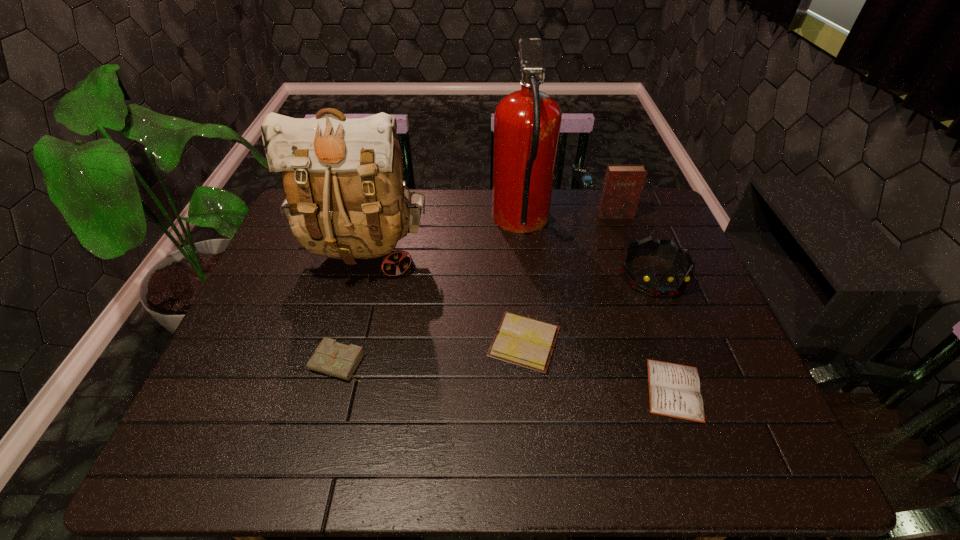
The width and height of the screenshot is (960, 540). In order to click on vacant region located with the handle and nozzle on the fire extinguisher in this screenshot , I will do `click(465, 223)`.

Locate an element on the screen. Image resolution: width=960 pixels, height=540 pixels. blank area located 0.240m with the handle and nozzle on the fire extinguisher is located at coordinates (418, 223).

Image resolution: width=960 pixels, height=540 pixels. I want to click on blank space located with the handle and nozzle on the fire extinguisher, so [x=461, y=223].

Locate an element on the screen. This screenshot has height=540, width=960. free point located 0.290m on the front-facing side of the backpack is located at coordinates (327, 386).

Find the location of a particular element. This screenshot has width=960, height=540. vacant space located 0.240m on the front cover of the tallest diary is located at coordinates click(635, 270).

Find the location of a particular element. free space located at the front of the tiara with jewels is located at coordinates (674, 327).

You are a GUI agent. You are given a task and a screenshot of the screen. Output one action in this format:
    pyautogui.click(x=<x>, y=<y>)
    Task: Click on the vacant point located 0.050m on the left of the leftmost diary
    The height and width of the screenshot is (540, 960).
    Given the screenshot: What is the action you would take?
    pyautogui.click(x=291, y=363)

Locate an element on the screen. Image resolution: width=960 pixels, height=540 pixels. vacant space located on the left of the third tallest diary is located at coordinates (401, 342).

Find the location of a particular element. This screenshot has height=540, width=960. vacant space located on the back of the shortest diary is located at coordinates (628, 258).

Find the location of `fire extinguisher that is at the far edge`. fire extinguisher that is at the far edge is located at coordinates (527, 122).